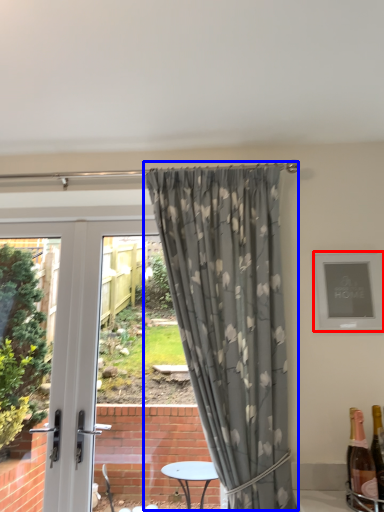
Question: Among these objects, which one is farthest to the camera, picture frame (highlighted by a red box) or curtain (highlighted by a blue box)?

Choices:
 (A) picture frame
 (B) curtain

Answer: (A)